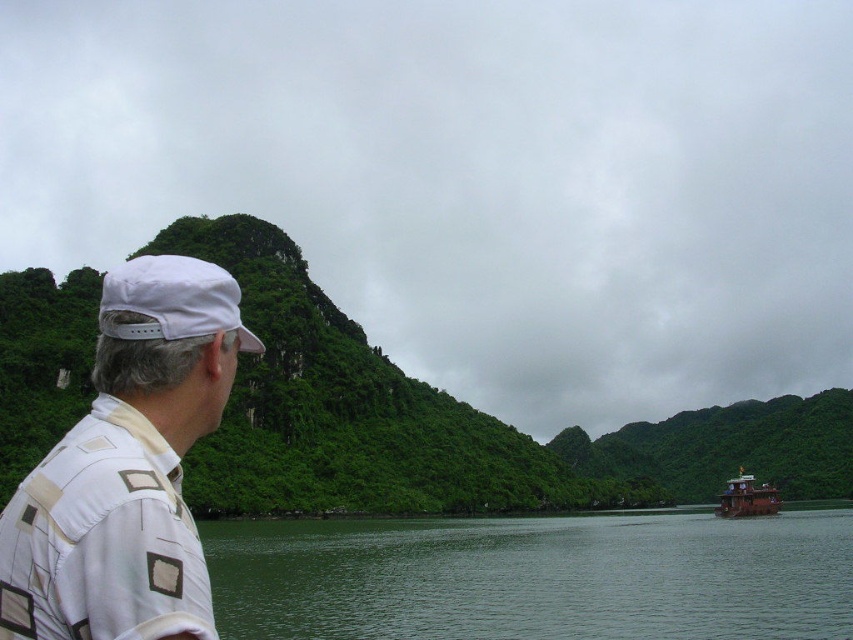
Which is more to the right, white fabric cap at upper left or brown wooden boat at right?

brown wooden boat at right

Is point (142, 269) positioned before point (755, 506)?

Yes, it is.

Where is `white fabric cap at upper left`? The height and width of the screenshot is (640, 853). white fabric cap at upper left is located at coordinates (173, 300).

Who is positioned more to the right, white fabric cap at left or white fabric cap at upper left?

white fabric cap at upper left

Who is lower down, white fabric cap at left or white fabric cap at upper left?

white fabric cap at left

Which is in front, point (177, 577) or point (126, 296)?

Point (177, 577) is more forward.

What are the coordinates of `white fabric cap at left` in the screenshot? It's located at (126, 467).

Identify the location of green smooth water at lower center. (535, 577).

Does green smooth water at lower center have a smaller size compared to white fabric cap at upper left?

No.

Who is more forward, (585, 620) or (202, 269)?

Positioned in front is point (202, 269).

Identify the location of green smooth water at lower center. Image resolution: width=853 pixels, height=640 pixels. (535, 577).